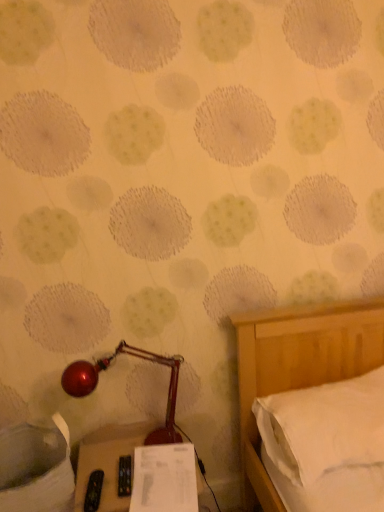
The image size is (384, 512). I want to click on vacant space situated above white paper at lower center (from a real-world perspective), so click(x=162, y=464).